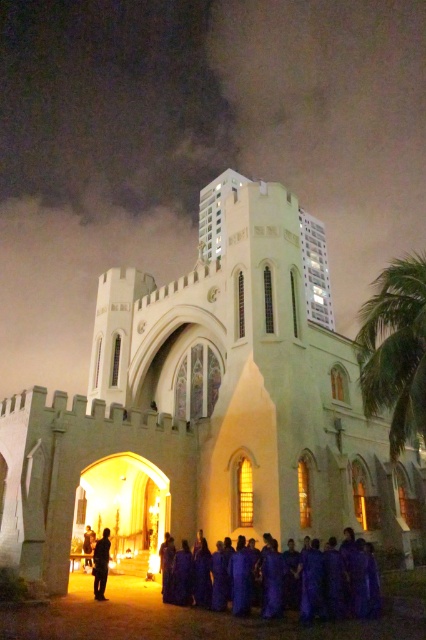
You are standing in front of the church and see a purple fabric person at center and a green leafy palm tree at right. Which object is located to the east of the other?

The green leafy palm tree at right is to the east of the purple fabric person at center because it is positioned to the right of the person in the image, and assuming the image is oriented with right as east.

You are attending a charity gala and see two purple items at the center of the scene. Which one is bigger between the purple matte dress at center and the purple fabric at center?

The purple matte dress at center is larger in size compared to the purple fabric at center.

Based on the photo, you are standing in front of the church and want to take a photo of both the green leafy palm tree at right and the purple fabric person at center. Which object should you zoom in on first to ensure both are in the frame?

You should zoom in on the purple fabric person at center first because the green leafy palm tree at right is larger in size than the purple fabric person at center, so adjusting the frame to accommodate the larger palm tree might require a wider angle, but starting with the smaller person ensures both fit without cropping.